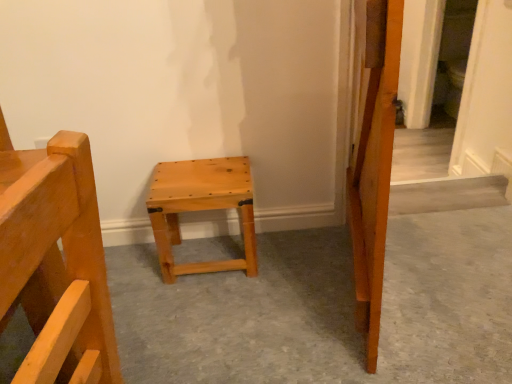
The height and width of the screenshot is (384, 512). What are the coordinates of `natural wood stool at center` in the screenshot? It's located at (201, 208).

The image size is (512, 384). Describe the element at coordinates (201, 208) in the screenshot. I see `natural wood stool at center` at that location.

In order to face natural wood stool at center, should I rotate leftwards or rightwards?

To align with it, rotate right about 6.478°.

Where is `natural wood stool at center`? The height and width of the screenshot is (384, 512). natural wood stool at center is located at coordinates (326, 308).

What do you see at coordinates (326, 308) in the screenshot?
I see `natural wood stool at center` at bounding box center [326, 308].

This screenshot has width=512, height=384. Find the location of `natural wood stool at center`. natural wood stool at center is located at coordinates (201, 208).

Is natural wood stool at center to the right of natural wood stool at center from the viewer's perspective?

No, natural wood stool at center is not to the right of natural wood stool at center.

Does natural wood stool at center lie behind natural wood stool at center?

Yes.

Consider the image. Which is nearer, (x=249, y=238) or (x=238, y=245)?

Point (x=249, y=238) is closer to the camera than point (x=238, y=245).

From the image's perspective, is natural wood stool at center above or below natural wood stool at center?

From the image's perspective, natural wood stool at center appears above natural wood stool at center.

From a real-world perspective, relative to natural wood stool at center, is natural wood stool at center vertically above or below?

Clearly, from a real-world perspective, natural wood stool at center is above natural wood stool at center.

Which object is wider, natural wood stool at center or natural wood stool at center?

natural wood stool at center is wider.

From their relative heights in the image, would you say natural wood stool at center is taller or shorter than natural wood stool at center?

Considering their sizes, natural wood stool at center has more height than natural wood stool at center.

Which of these two, natural wood stool at center or natural wood stool at center, is smaller?

natural wood stool at center.

Is natural wood stool at center located outside natural wood stool at center?

That's correct, natural wood stool at center is outside of natural wood stool at center.

Is natural wood stool at center far from natural wood stool at center?

No, natural wood stool at center is in close proximity to natural wood stool at center.

Is natural wood stool at center oriented away from natural wood stool at center?

No, natural wood stool at center is not at the back of natural wood stool at center.

Find the location of a particular element. The image size is (512, 384). stool located on the left of natural wood stool at center is located at coordinates (201, 208).

Considering the relative positions of natural wood stool at center and natural wood stool at center in the image provided, is natural wood stool at center to the left of natural wood stool at center from the viewer's perspective?

No, natural wood stool at center is not to the left of natural wood stool at center.

In the image, is natural wood stool at center positioned in front of or behind natural wood stool at center?

Clearly, natural wood stool at center is in front of natural wood stool at center.

Does point (383, 355) appear closer or farther from the camera than point (241, 226)?

Clearly, point (383, 355) is closer to the camera than point (241, 226).

From the image's perspective, which object appears higher, natural wood stool at center or natural wood stool at center?

natural wood stool at center.

From a real-world perspective, relative to natural wood stool at center, is natural wood stool at center vertically above or below?

natural wood stool at center is situated lower than natural wood stool at center in the real world.

Considering the sizes of natural wood stool at center and natural wood stool at center in the image, is natural wood stool at center wider or thinner than natural wood stool at center?

natural wood stool at center is wider than natural wood stool at center.

Between natural wood stool at center and natural wood stool at center, which one has more height?

With more height is natural wood stool at center.

Between natural wood stool at center and natural wood stool at center, which one has smaller size?

natural wood stool at center.

Is natural wood stool at center surrounded by natural wood stool at center?

That's incorrect, natural wood stool at center is not inside natural wood stool at center.

Is natural wood stool at center next to natural wood stool at center and touching it?

No, natural wood stool at center is not making contact with natural wood stool at center.

From the picture: Is natural wood stool at center aimed at natural wood stool at center?

No, natural wood stool at center does not turn towards natural wood stool at center.

The width and height of the screenshot is (512, 384). What are the coordinates of `concrete in front of the natural wood stool at center` in the screenshot? It's located at (326, 308).

Identify the location of stool behind the natural wood stool at center. This screenshot has height=384, width=512. (201, 208).

Identify the location of concrete located on the right of natural wood stool at center. This screenshot has width=512, height=384. (326, 308).